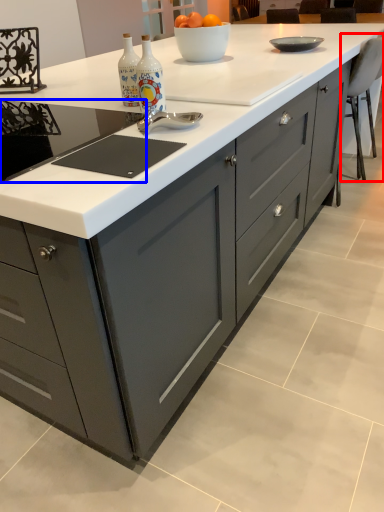
Question: Which of the following is the closest to the observer, chair (highlighted by a red box) or gas stove (highlighted by a blue box)?

Choices:
 (A) chair
 (B) gas stove

Answer: (B)